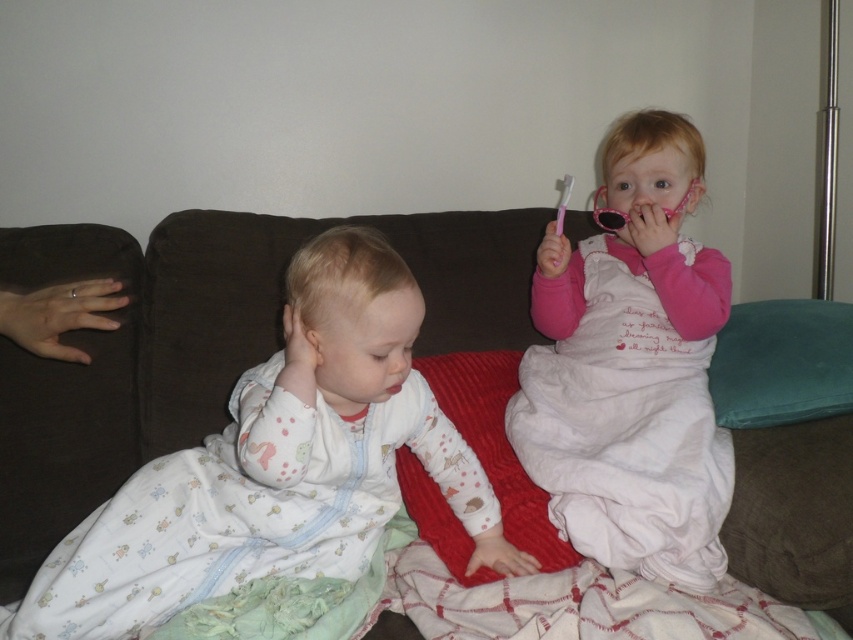
Consider the image. Is pink satin dress at upper right bigger than pink matte lips at center?

Indeed, pink satin dress at upper right has a larger size compared to pink matte lips at center.

Who is taller, pink satin dress at upper right or pink matte lips at center?

Standing taller between the two is pink satin dress at upper right.

Does point (553, 289) come closer to viewer compared to point (398, 385)?

No, (553, 289) is behind (398, 385).

Find the location of `pink satin dress at upper right`. pink satin dress at upper right is located at coordinates (631, 369).

Who is more distant from viewer, (x=558, y=248) or (x=566, y=188)?

Point (x=566, y=188)

Can you confirm if pink satin dress at upper right is shorter than pink plastic toothbrush at upper right?

In fact, pink satin dress at upper right may be taller than pink plastic toothbrush at upper right.

This screenshot has height=640, width=853. Identify the location of pink satin dress at upper right. (631, 369).

Is white cotton onesie at left wider than pink satin dress at upper right?

Yes.

Between white cotton onesie at left and pink satin dress at upper right, which one appears on the left side from the viewer's perspective?

From the viewer's perspective, white cotton onesie at left appears more on the left side.

Where is `white cotton onesie at left`? This screenshot has height=640, width=853. white cotton onesie at left is located at coordinates (277, 465).